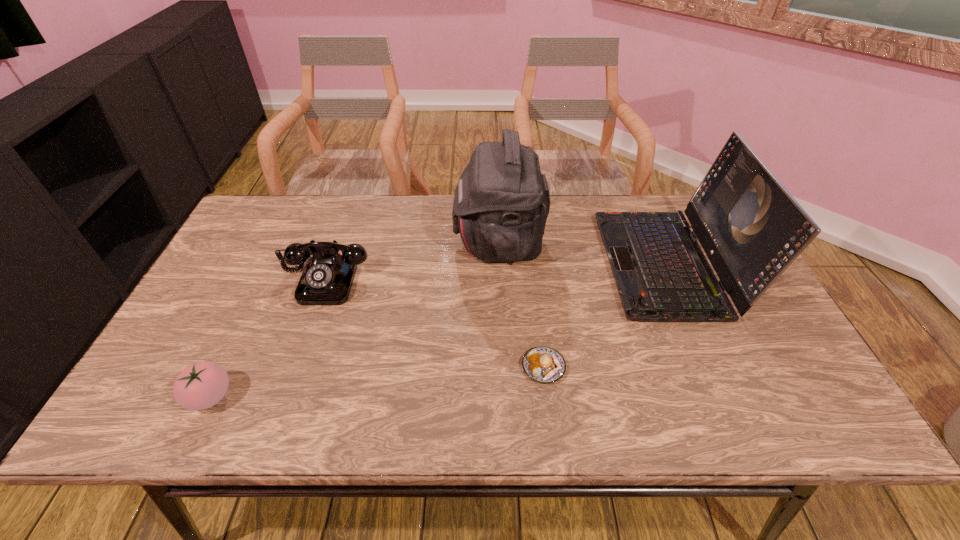
This screenshot has width=960, height=540. What are the coordinates of `shoulder bag` in the screenshot? It's located at pos(501,203).

Locate an element on the screen. the rightmost object is located at coordinates (751, 228).

Find the location of a particular element. The width and height of the screenshot is (960, 540). telephone is located at coordinates click(327, 278).

Find the location of a particular element. The height and width of the screenshot is (540, 960). tomato is located at coordinates (201, 385).

Image resolution: width=960 pixels, height=540 pixels. In order to click on pastry in this screenshot , I will do `click(542, 364)`.

Locate an element on the screen. vacant space located 0.320m on the open flap of the shoulder bag is located at coordinates (348, 241).

Find the location of a particular element. The height and width of the screenshot is (540, 960). vacant space situated on the open flap of the shoulder bag is located at coordinates (354, 241).

Locate an element on the screen. The width and height of the screenshot is (960, 540). vacant space located 0.170m on the open flap of the shoulder bag is located at coordinates (397, 241).

Identify the location of vacant space positioned on the screen of the rightmost object. The width and height of the screenshot is (960, 540). (495, 264).

Locate an element on the screen. free location located on the screen of the rightmost object is located at coordinates (531, 264).